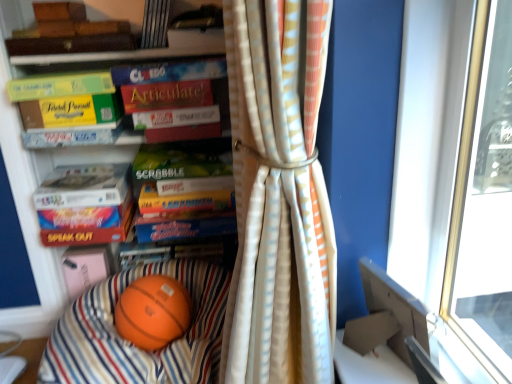
Question: Can you confirm if rubberized orange ball at lower left is wider than orange rubber basketball at center?

Choices:
 (A) yes
 (B) no

Answer: (A)

Question: From a real-world perspective, is rubberized orange ball at lower left located beneath orange rubber basketball at center?

Choices:
 (A) yes
 (B) no

Answer: (A)

Question: From a real-world perspective, is rubberized orange ball at lower left physically above orange rubber basketball at center?

Choices:
 (A) yes
 (B) no

Answer: (B)

Question: Is rubberized orange ball at lower left positioned far away from orange rubber basketball at center?

Choices:
 (A) yes
 (B) no

Answer: (B)

Question: Can you confirm if rubberized orange ball at lower left is positioned to the right of orange rubber basketball at center?

Choices:
 (A) no
 (B) yes

Answer: (A)

Question: Considering the relative sizes of rubberized orange ball at lower left and orange rubber basketball at center in the image provided, is rubberized orange ball at lower left smaller than orange rubber basketball at center?

Choices:
 (A) yes
 (B) no

Answer: (B)

Question: Is hardcover book at upper center, the second book positioned from the back, looking in the opposite direction of matte red book at left, which ranks as the 12th paperback book in top-to-bottom order?

Choices:
 (A) no
 (B) yes

Answer: (A)

Question: Can you confirm if hardcover book at upper center, the first book viewed from the top, is bigger than matte red book at left, the 1th paperback book when ordered from bottom to top?

Choices:
 (A) yes
 (B) no

Answer: (B)

Question: Is hardcover book at upper center, which is the 3th book in bottom-to-top order, oriented towards matte red book at left, the 1th paperback book when ordered from bottom to top?

Choices:
 (A) yes
 (B) no

Answer: (B)

Question: Does hardcover book at upper center, which is the 3th book in bottom-to-top order, have a greater height compared to matte red book at left, the 1th paperback book when ordered from bottom to top?

Choices:
 (A) yes
 (B) no

Answer: (A)

Question: Can you confirm if hardcover book at upper center, the first book viewed from the top, is wider than matte red book at left, which ranks as the 12th paperback book in top-to-bottom order?

Choices:
 (A) yes
 (B) no

Answer: (B)

Question: Is hardcover book at upper center, the second book positioned from the back, at the right side of matte red book at left, which ranks as the 12th paperback book in top-to-bottom order?

Choices:
 (A) yes
 (B) no

Answer: (A)

Question: Is green matte book at upper left, which appears as the 3th paperback book when viewed from the top, closer to camera compared to matte white paperback book at center, which is counted as the seventh paperback book, starting from the top?

Choices:
 (A) no
 (B) yes

Answer: (B)